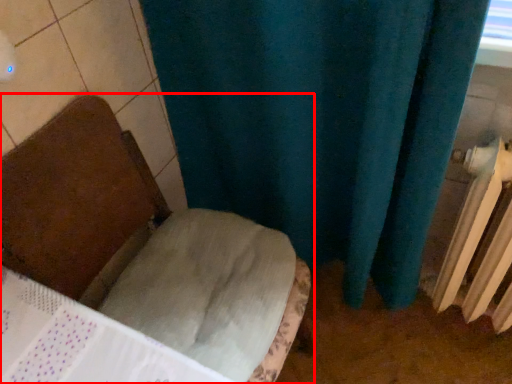
Question: From the image, what is the correct spatial relationship of furniture (annotated by the red box) in relation to radiator?

Choices:
 (A) left
 (B) right

Answer: (A)